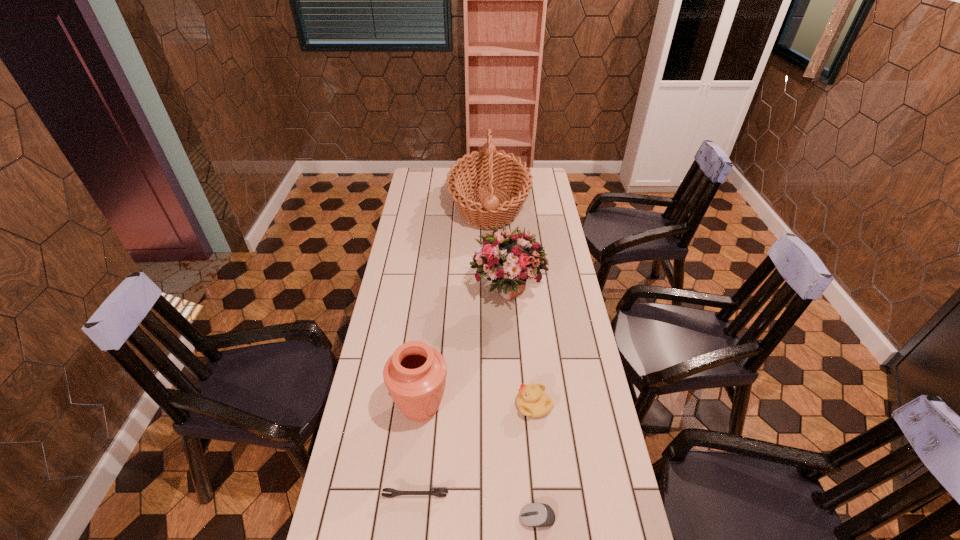
Identify which object is the nearest to the fifth tallest object. Please provide its 2D coordinates. Your answer should be formatted as a tuple, i.e. [(x, y)], where the tuple contains the x and y coordinates of a point satisfying the conditions above.

[(415, 374)]

You are a GUI agent. You are given a task and a screenshot of the screen. Output one action in this format:
    pyautogui.click(x=<x>, y=<y>)
    Task: Click on the vacant region that satisfies the following two spatial constraints: 1. on the beak of the third shortest object; 2. on the open ends of the wrench
    
    Given the screenshot: What is the action you would take?
    pyautogui.click(x=543, y=496)

The width and height of the screenshot is (960, 540). Identify the location of free space in the image that satisfies the following two spatial constraints: 1. on the beak of the duckling; 2. on the front side of the vase. (534, 408).

Locate an element on the screen. This screenshot has height=540, width=960. vacant space that satisfies the following two spatial constraints: 1. on the beak of the duckling; 2. on the open ends of the fifth farthest object is located at coordinates (543, 496).

Where is `vacant space that satisfies the following two spatial constraints: 1. on the beak of the duckling; 2. on the open ends of the second nearest object`? vacant space that satisfies the following two spatial constraints: 1. on the beak of the duckling; 2. on the open ends of the second nearest object is located at coordinates (543, 496).